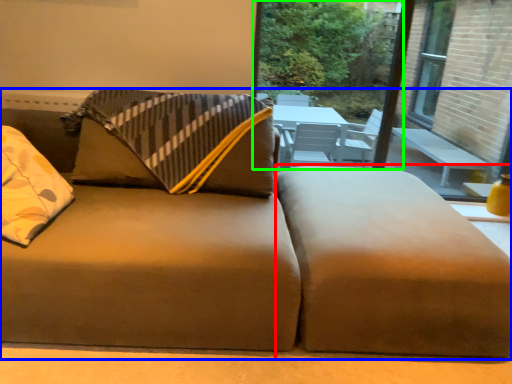
Question: Which object is positioned farthest from footrest (highlighted by a red box)? Select from studio couch (highlighted by a blue box) and window screen (highlighted by a green box).

Choices:
 (A) studio couch
 (B) window screen

Answer: (B)